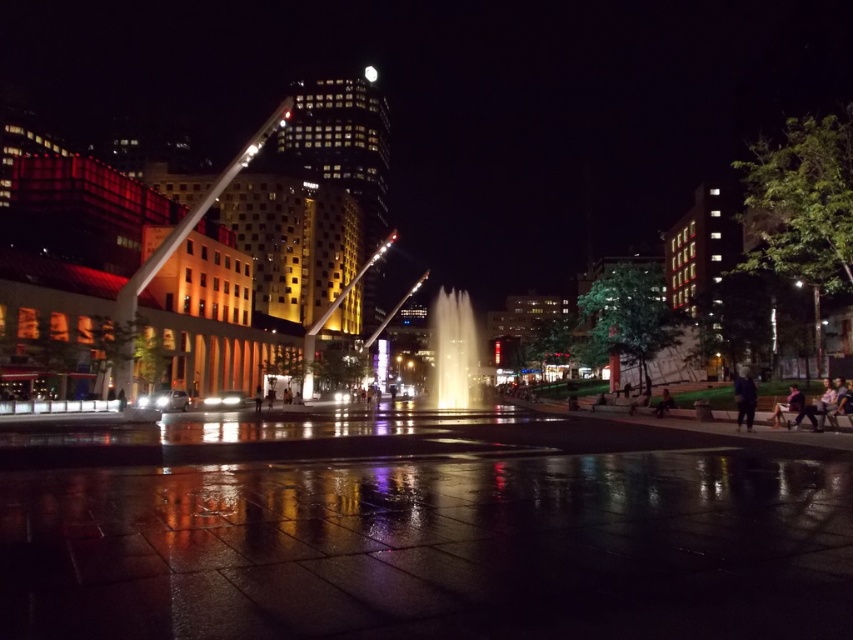
Question: Among these objects, which one is nearest to the camera?

Choices:
 (A) dark blue fabric at lower right
 (B) white glossy light at center

Answer: (A)

Question: Can you confirm if illuminated glass fountain at center is wider than dark blue fabric at lower right?

Choices:
 (A) no
 (B) yes

Answer: (B)

Question: Does illuminated glass fountain at center have a smaller size compared to white glossy light at center?

Choices:
 (A) no
 (B) yes

Answer: (A)

Question: Can you confirm if illuminated glass fountain at center is positioned to the left of white glossy light at center?

Choices:
 (A) yes
 (B) no

Answer: (B)

Question: Among these objects, which one is farthest from the camera?

Choices:
 (A) illuminated glass fountain at center
 (B) white glossy light at center
 (C) dark blue fabric at lower right

Answer: (B)

Question: Which point is closer to the camera?

Choices:
 (A) dark blue fabric at lower right
 (B) white glossy light at center
 (C) illuminated glass fountain at center

Answer: (A)